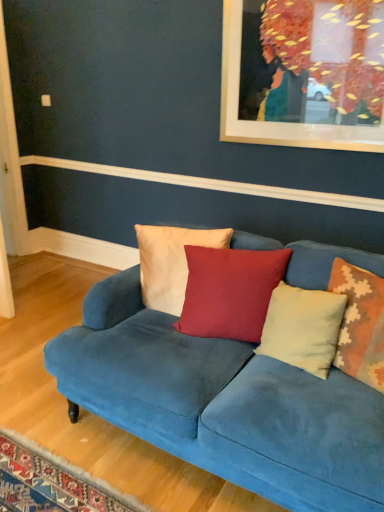
Question: From a real-world perspective, is beige textured pillow at right, which is the fourth pillow in left-to-right order, above or below light beige velvet pillow at center, positioned as the second pillow in right-to-left order?

Choices:
 (A) below
 (B) above

Answer: (B)

Question: In the image, is beige textured pillow at right, which is the fourth pillow in left-to-right order, positioned in front of or behind light beige velvet pillow at center, which ranks as the third pillow in left-to-right order?

Choices:
 (A) front
 (B) behind

Answer: (A)

Question: Which is nearer to the light beige velvet pillow at center, which ranks as the third pillow in left-to-right order?

Choices:
 (A) velvet blue couch at center
 (B) white cotton pillow at center, placed as the 1th pillow when sorted from left to right
 (C) matte red cushion at center, the 3th pillow from the right
 (D) beige textured pillow at right, which is the fourth pillow in left-to-right order

Answer: (D)

Question: Based on their relative distances, which object is farther from the velvet blue couch at center?

Choices:
 (A) light beige velvet pillow at center, which ranks as the third pillow in left-to-right order
 (B) beige textured pillow at right, which is counted as the 1th pillow, starting from the right
 (C) white cotton pillow at center, placed as the 1th pillow when sorted from left to right
 (D) matte red cushion at center, the 3th pillow from the right

Answer: (B)